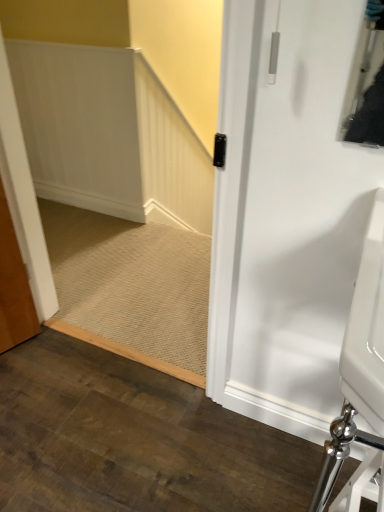
What do you see at coordinates (360, 374) in the screenshot? The width and height of the screenshot is (384, 512). I see `white glossy sink at lower right` at bounding box center [360, 374].

At what (x,y) coordinates should I click in order to perform the action: click on white glossy sink at lower right. Please return your answer as a coordinate pair (x, y). The height and width of the screenshot is (512, 384). Looking at the image, I should click on (360, 374).

What is the approximate width of white glossy sink at lower right?

white glossy sink at lower right is 17.70 inches wide.

Locate an element on the screen. The height and width of the screenshot is (512, 384). beige carpet at center is located at coordinates (131, 287).

What do you see at coordinates (131, 287) in the screenshot? I see `beige carpet at center` at bounding box center [131, 287].

The width and height of the screenshot is (384, 512). Identify the location of white glossy sink at lower right. (360, 374).

Considering the positions of objects white glossy sink at lower right and beige carpet at center in the image provided, who is more to the right, white glossy sink at lower right or beige carpet at center?

Positioned to the right is white glossy sink at lower right.

Considering the positions of objects white glossy sink at lower right and beige carpet at center in the image provided, who is in front, white glossy sink at lower right or beige carpet at center?

white glossy sink at lower right is in front.

Does point (353, 318) lie behind point (163, 304)?

No, (353, 318) is closer to viewer.

From the image's perspective, who appears lower, white glossy sink at lower right or beige carpet at center?

From the image's view, white glossy sink at lower right is below.

From a real-world perspective, which is physically below, white glossy sink at lower right or beige carpet at center?

From a 3D spatial view, beige carpet at center is below.

Based on the photo, looking at their sizes, would you say white glossy sink at lower right is wider or thinner than beige carpet at center?

Clearly, white glossy sink at lower right has less width compared to beige carpet at center.

Does white glossy sink at lower right have a lesser height compared to beige carpet at center?

Incorrect, the height of white glossy sink at lower right does not fall short of that of beige carpet at center.

Can you confirm if white glossy sink at lower right is bigger than beige carpet at center?

Yes, white glossy sink at lower right is bigger than beige carpet at center.

Is white glossy sink at lower right situated inside beige carpet at center or outside?

white glossy sink at lower right is outside beige carpet at center.

Is white glossy sink at lower right far away from beige carpet at center?

white glossy sink at lower right is far away from beige carpet at center.

Does white glossy sink at lower right turn towards beige carpet at center?

No, white glossy sink at lower right is not facing towards beige carpet at center.

Can you tell me how much white glossy sink at lower right and beige carpet at center differ in facing direction?

The angular difference between white glossy sink at lower right and beige carpet at center is 1.49 degrees.

Identify the location of sink located on the right of beige carpet at center. Image resolution: width=384 pixels, height=512 pixels. (360, 374).

Considering the relative positions of beige carpet at center and white glossy sink at lower right in the image provided, is beige carpet at center to the right of white glossy sink at lower right from the viewer's perspective?

No, beige carpet at center is not to the right of white glossy sink at lower right.

Is beige carpet at center in front of white glossy sink at lower right?

No, beige carpet at center is further to the viewer.

Which point is more forward, (x=139, y=351) or (x=356, y=441)?

The point (x=356, y=441) is closer to the camera.

From the image's perspective, is beige carpet at center above white glossy sink at lower right?

Indeed, from the image's perspective, beige carpet at center is shown above white glossy sink at lower right.

From a real-world perspective, which object stands above the other?

In real-world perspective, white glossy sink at lower right is above.

Is beige carpet at center thinner than white glossy sink at lower right?

No.

Considering the sizes of objects beige carpet at center and white glossy sink at lower right in the image provided, who is taller, beige carpet at center or white glossy sink at lower right?

white glossy sink at lower right is taller.

Which of these two, beige carpet at center or white glossy sink at lower right, is bigger?

white glossy sink at lower right is bigger.

Choose the correct answer: Is beige carpet at center inside white glossy sink at lower right or outside it?

beige carpet at center is outside white glossy sink at lower right.

Is beige carpet at center next to white glossy sink at lower right?

There is a gap between beige carpet at center and white glossy sink at lower right.

Is beige carpet at center aimed at white glossy sink at lower right?

No, beige carpet at center is not turned towards white glossy sink at lower right.

How many degrees apart are the facing directions of beige carpet at center and white glossy sink at lower right?

They differ by 1.49 degrees in their facing directions.

Identify the location of stairs on the left of white glossy sink at lower right. (131, 287).

Find the location of a particular element. This screenshot has height=512, width=384. sink located on the right of beige carpet at center is located at coordinates (360, 374).

The height and width of the screenshot is (512, 384). Find the location of `sink in front of the beige carpet at center`. sink in front of the beige carpet at center is located at coordinates (360, 374).